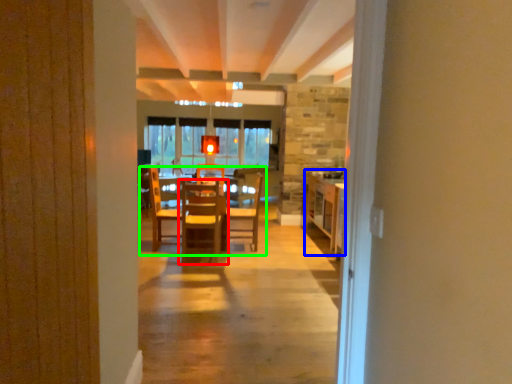
Question: Which is farther away from chair (highlighted by a red box)? table (highlighted by a blue box) or table (highlighted by a green box)?

Choices:
 (A) table
 (B) table

Answer: (A)